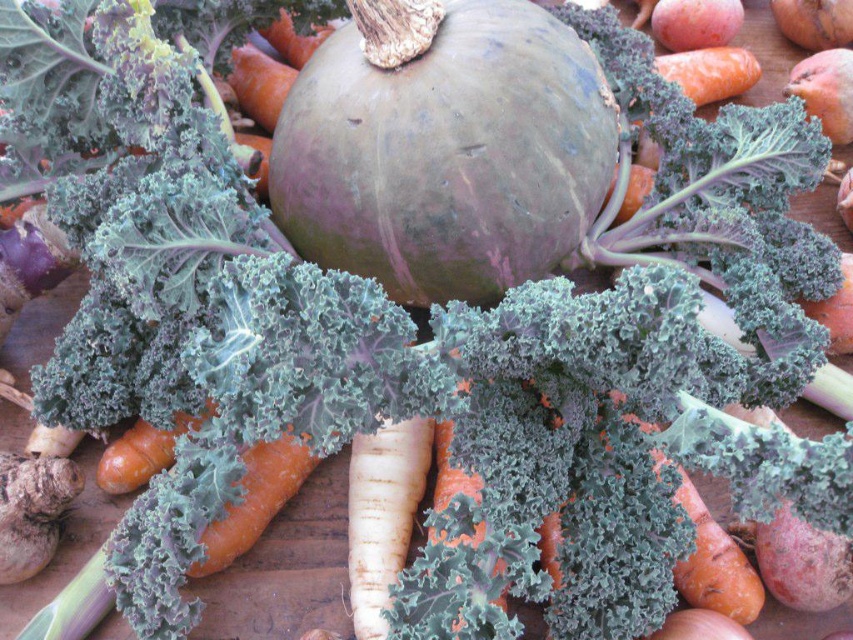
Can you confirm if orange matte carrot at center is positioned above smooth brown onion at lower right?

Yes.

Find the location of a particular element. orange matte carrot at center is located at coordinates (x=715, y=564).

Is orange smooth carrot at center thinner than smooth brown onion at lower right?

Indeed, orange smooth carrot at center has a lesser width compared to smooth brown onion at lower right.

I want to click on orange smooth carrot at center, so click(259, 84).

Identify the location of orange smooth carrot at center. (259, 84).

Can you confirm if orange matte carrot at center is bigger than orange smooth carrot at center?

Correct, orange matte carrot at center is larger in size than orange smooth carrot at center.

Can you confirm if orange matte carrot at center is smaller than orange smooth carrot at center?

No, orange matte carrot at center is not smaller than orange smooth carrot at center.

Does point (751, 620) come behind point (279, 90)?

No, (751, 620) is in front of (279, 90).

Where is `orange matte carrot at center`? The image size is (853, 640). orange matte carrot at center is located at coordinates (715, 564).